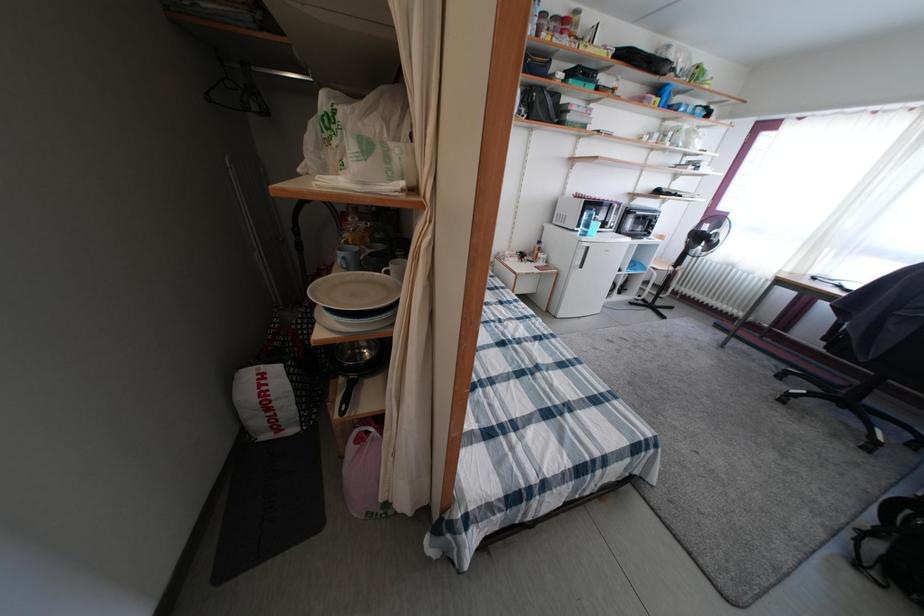
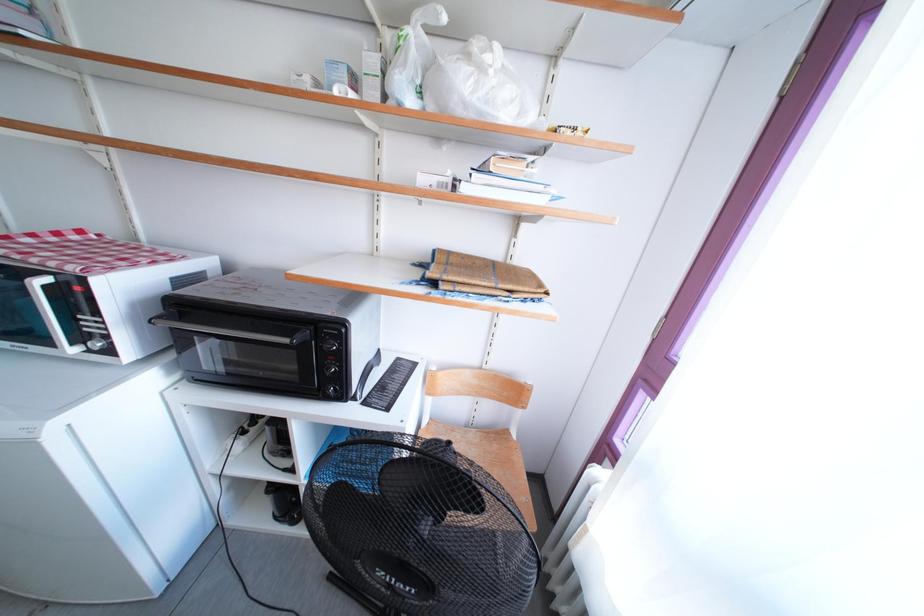
In a continuous first-person perspective shot, in which direction is the camera moving?

The movement direction of the cameraman is right, forward.